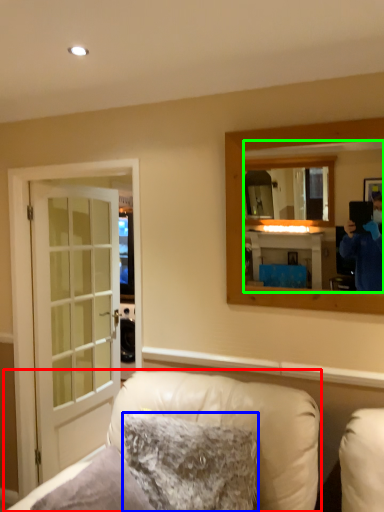
Question: Which object is positioned closest to furniture (highlighted by a red box)? Select from pillow (highlighted by a blue box) and mirror (highlighted by a green box).

Choices:
 (A) pillow
 (B) mirror

Answer: (A)